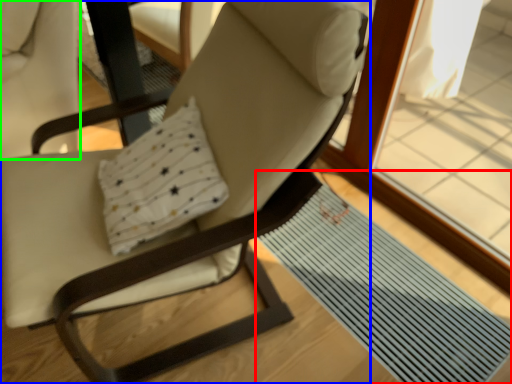
Question: Based on their relative distances, which object is nearer to mat (highlighted by a red box)? Choose from chair (highlighted by a blue box) and swivel chair (highlighted by a green box).

Choices:
 (A) chair
 (B) swivel chair

Answer: (A)